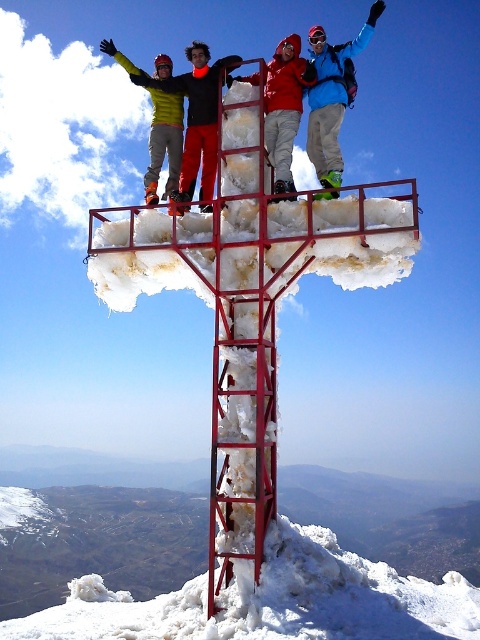
Which is above, red metal cross at center or white frosty snow at lower center?

red metal cross at center is above.

Which is more to the left, red metal cross at center or white frosty snow at lower center?

red metal cross at center

Describe the element at coordinates (249, 301) in the screenshot. I see `red metal cross at center` at that location.

You are a GUI agent. You are given a task and a screenshot of the screen. Output one action in this format:
    pyautogui.click(x=<x>, y=<y>)
    Task: Click on the red metal cross at center
    The height and width of the screenshot is (640, 480).
    Given the screenshot: What is the action you would take?
    pyautogui.click(x=249, y=301)

Is red metal cross at center wider than matte red jacket at center?

Yes.

Who is positioned more to the left, red metal cross at center or matte red jacket at center?

From the viewer's perspective, red metal cross at center appears more on the left side.

Image resolution: width=480 pixels, height=640 pixels. In order to click on red metal cross at center in this screenshot , I will do `click(249, 301)`.

Find the location of a particular element. This screenshot has width=480, height=640. red metal cross at center is located at coordinates (249, 301).

Where is `yellow-green ski suit at upper left`? This screenshot has width=480, height=640. yellow-green ski suit at upper left is located at coordinates (196, 115).

Does yellow-green ski suit at upper left have a lesser height compared to yellow-green jacket at upper left?

Yes.

Measure the distance between yellow-green ski suit at upper left and camera.

The distance of yellow-green ski suit at upper left from camera is 29.87 meters.

Find the location of a particular element. The image size is (480, 640). yellow-green ski suit at upper left is located at coordinates (196, 115).